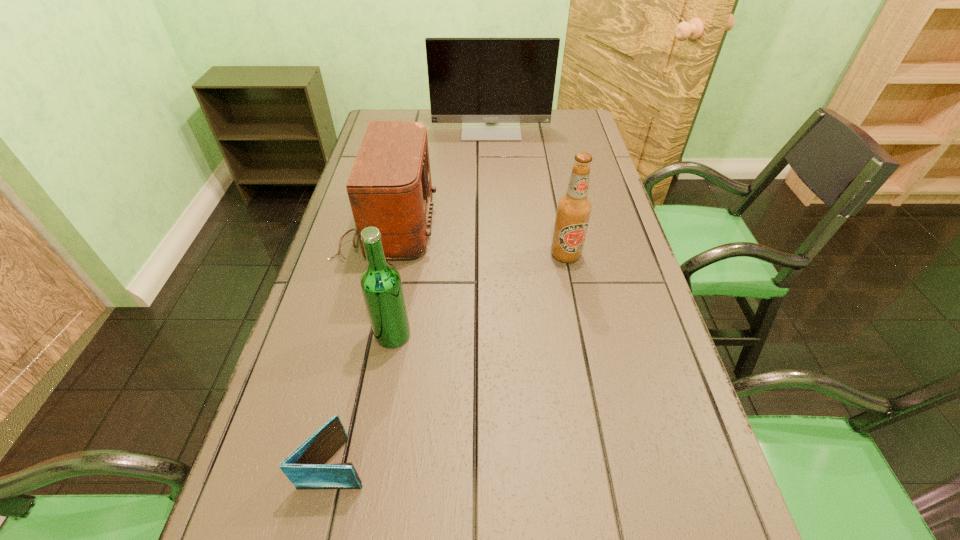
Image resolution: width=960 pixels, height=540 pixels. In order to click on vacant space at the far left corner of the desktop in this screenshot , I will do (394, 112).

Identify the location of vacant region at the far right corner of the desktop. Image resolution: width=960 pixels, height=540 pixels. (585, 134).

Identify the location of vacant space that's between the farthest object and the fourth tallest object. This screenshot has height=540, width=960. (440, 177).

The image size is (960, 540). What are the coordinates of `empty space that is in between the second nearest object and the computer monitor` in the screenshot? It's located at pyautogui.click(x=442, y=231).

You are a GUI agent. You are given a task and a screenshot of the screen. Output one action in this format:
    pyautogui.click(x=<x>, y=<y>)
    Task: Click on the empty location between the farther beer bottle and the nearer beer bottle
    
    Given the screenshot: What is the action you would take?
    pyautogui.click(x=479, y=295)

This screenshot has height=540, width=960. Find the location of `empty space between the right beer bottle and the left beer bottle`. empty space between the right beer bottle and the left beer bottle is located at coordinates pyautogui.click(x=479, y=295).

Locate an element on the screen. The image size is (960, 540). blank region between the nearest object and the computer monitor is located at coordinates (413, 295).

Find the location of `empty space between the farthest object and the farther beer bottle`. empty space between the farthest object and the farther beer bottle is located at coordinates (528, 191).

Locate an element on the screen. The width and height of the screenshot is (960, 540). empty location between the nearest object and the left beer bottle is located at coordinates (364, 399).

Find the location of a particular element. This screenshot has height=540, width=960. vacant space that's between the second shortest object and the farther beer bottle is located at coordinates (477, 240).